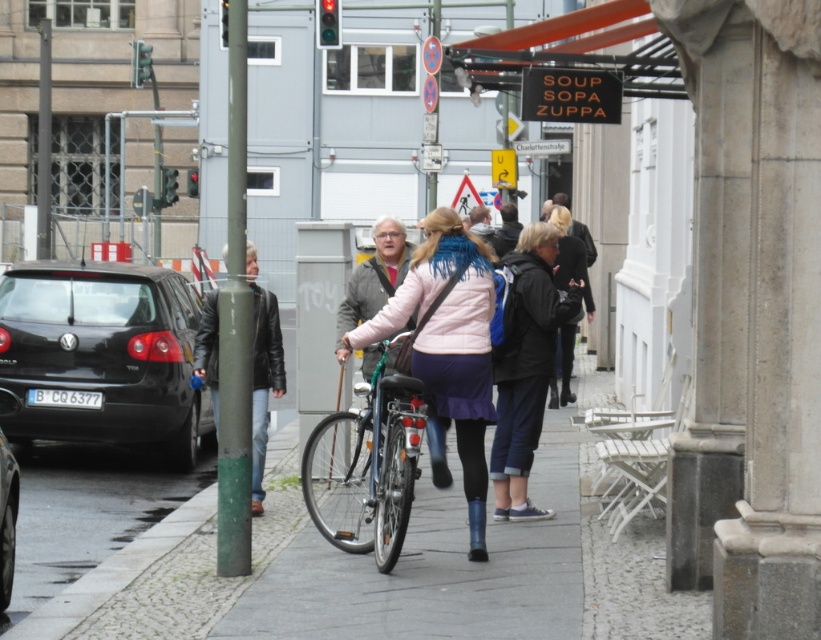
Question: Which point appears closest to the camera in this image?

Choices:
 (A) (49, 436)
 (B) (414, 384)

Answer: (B)

Question: Is matte pink jacket at center positioned in front of shiny metallic bicycle at center?

Choices:
 (A) no
 (B) yes

Answer: (A)

Question: Is paved stone sidewalk at center to the left of shiny metallic bicycle at center from the viewer's perspective?

Choices:
 (A) yes
 (B) no

Answer: (B)

Question: Can you confirm if green metallic pole at center is wider than blue denim pants at center?

Choices:
 (A) no
 (B) yes

Answer: (B)

Question: Estimate the real-world distances between objects in this image. Which object is closer to the paved stone sidewalk at center?

Choices:
 (A) black glossy car at left
 (B) green metallic pole at center
 (C) matte pink jacket at center
 (D) blue denim pants at center

Answer: (C)

Question: Which point is farther from the camera taking this photo?

Choices:
 (A) (560, 211)
 (B) (53, 435)
 (C) (0, 403)
 (D) (413, 298)

Answer: (A)